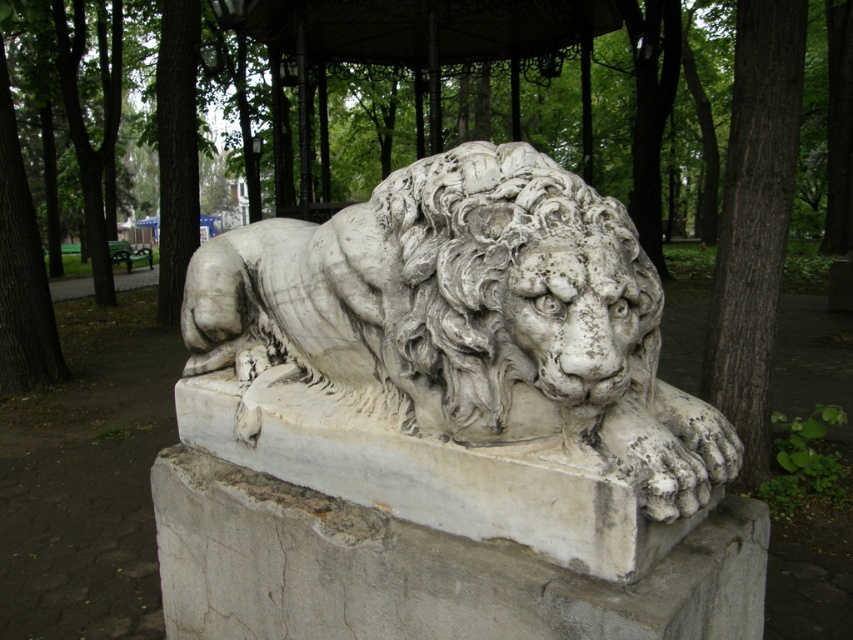
Question: Among these points, which one is farthest from the camera?

Choices:
 (A) (465, 257)
 (B) (723, 330)

Answer: (B)

Question: Is white marble lion at center thinner than dark brown bark tree at right?

Choices:
 (A) yes
 (B) no

Answer: (B)

Question: Among these objects, which one is farthest from the camera?

Choices:
 (A) white marble lion at center
 (B) dark brown bark tree at right

Answer: (B)

Question: Is white marble lion at center closer to camera compared to dark brown bark tree at right?

Choices:
 (A) yes
 (B) no

Answer: (A)

Question: Is white marble lion at center positioned before dark brown bark tree at right?

Choices:
 (A) yes
 (B) no

Answer: (A)